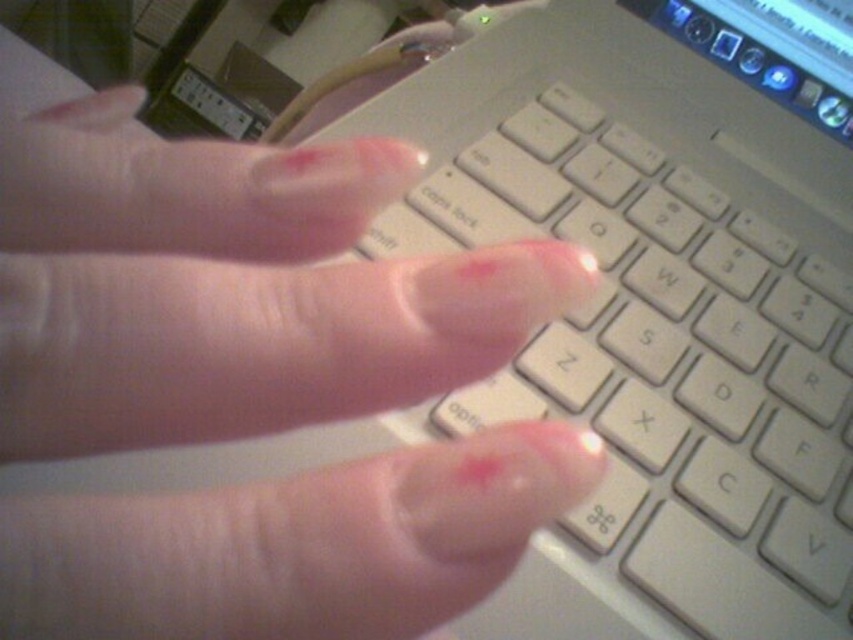
From the picture: Is white plastic keyboard at center shorter than clear skin at center?

No, white plastic keyboard at center is not shorter than clear skin at center.

Image resolution: width=853 pixels, height=640 pixels. Find the location of `white plastic keyboard at center`. white plastic keyboard at center is located at coordinates (653, 300).

Find the location of a particular element. white plastic keyboard at center is located at coordinates tap(653, 300).